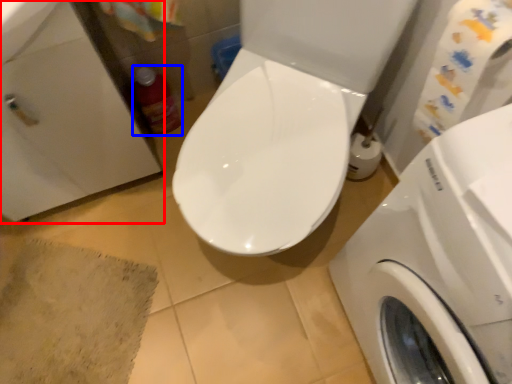
Question: Which object appears closest to the camera in this image, sink (highlighted by a red box) or cleaning product (highlighted by a blue box)?

Choices:
 (A) sink
 (B) cleaning product

Answer: (A)